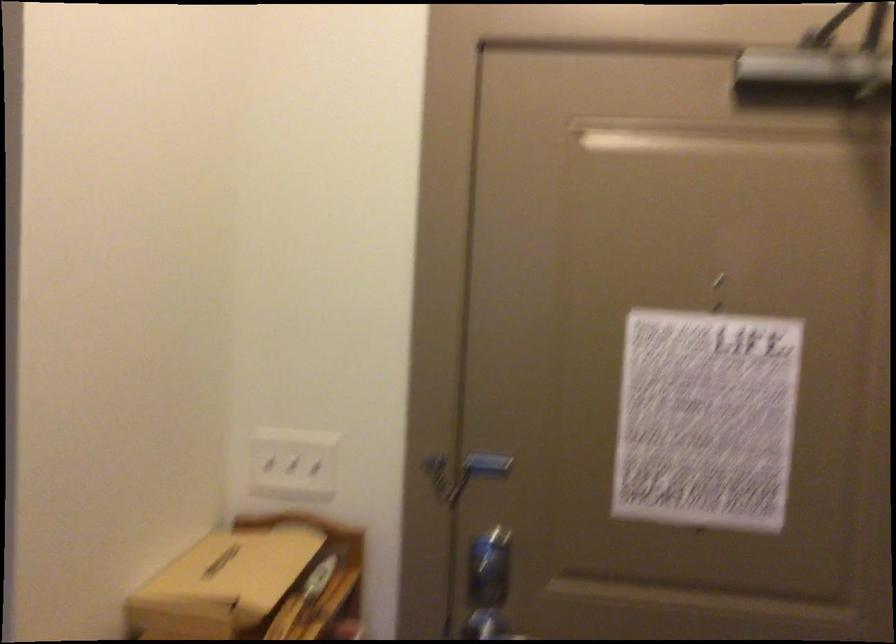
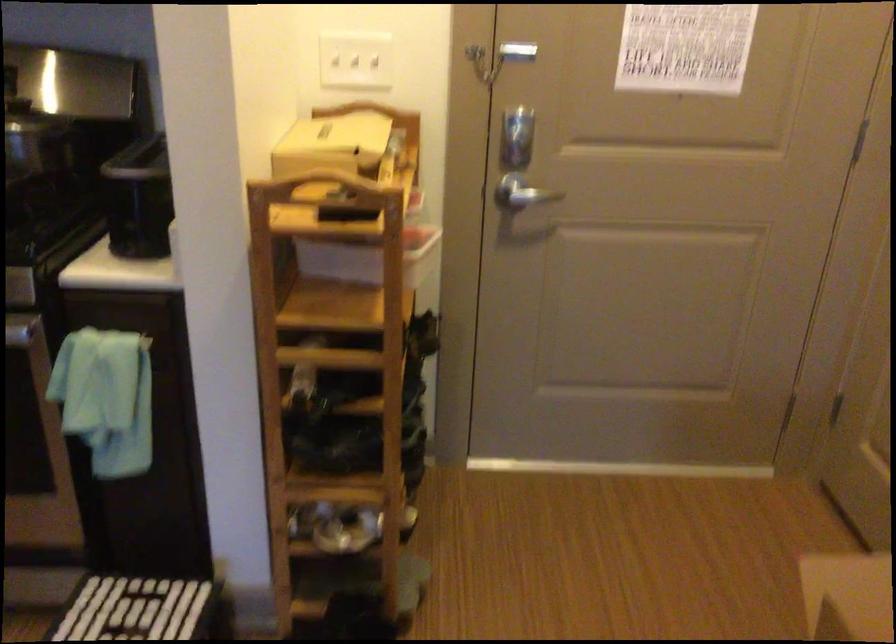
In the second image, find the point that corresponds to point (286, 466) in the first image.

(356, 61)